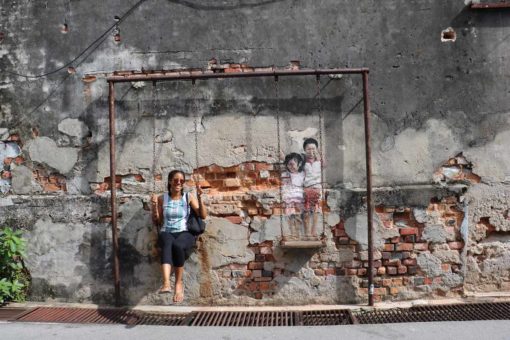
Locate an element on the screen. The image size is (510, 340). cable or shadow of one is located at coordinates (92, 44).